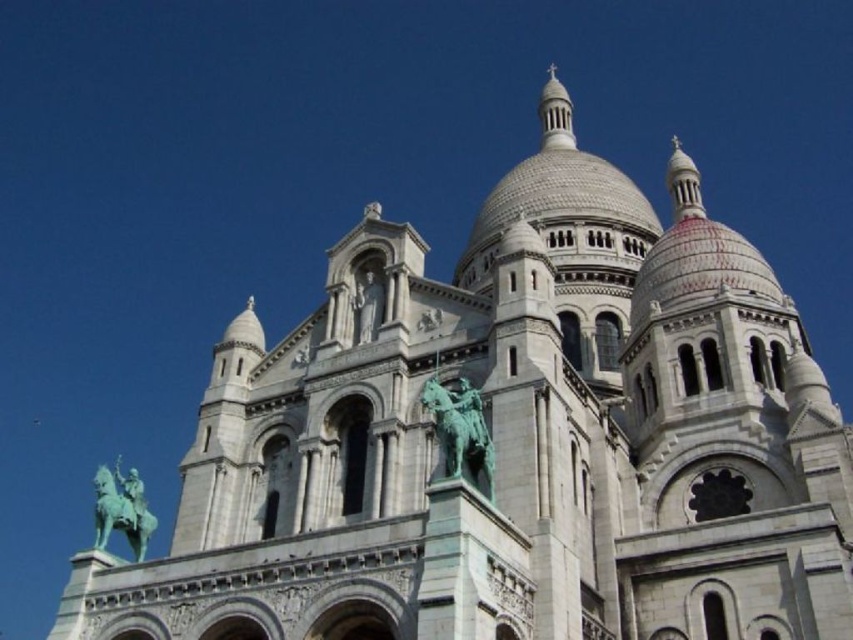
Looking at this image, is green patina statue at center wider than white stone statue at center?

Yes, green patina statue at center is wider than white stone statue at center.

Is green patina statue at center shorter than white stone statue at center?

In fact, green patina statue at center may be taller than white stone statue at center.

Locate an element on the screen. The height and width of the screenshot is (640, 853). green patina statue at center is located at coordinates (461, 432).

Who is taller, green patina statue at lower left or white stone statue at center?

green patina statue at lower left is taller.

Which is more to the right, green patina statue at lower left or white stone statue at center?

white stone statue at center is more to the right.

Describe the element at coordinates (120, 508) in the screenshot. I see `green patina statue at lower left` at that location.

Image resolution: width=853 pixels, height=640 pixels. What are the coordinates of `green patina statue at lower left` in the screenshot? It's located at (120, 508).

Does point (486, 461) come closer to viewer compared to point (103, 468)?

Yes.

Who is shorter, green patina statue at center or green patina statue at lower left?

green patina statue at center is shorter.

In the scene shown: Who is more forward, (480, 435) or (148, 522)?

Point (480, 435) is in front.

Identify the location of green patina statue at center. The height and width of the screenshot is (640, 853). (461, 432).